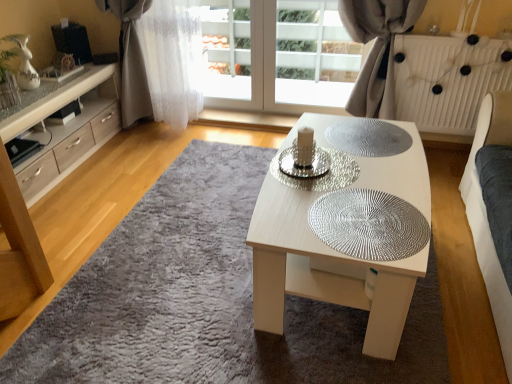
At what (x,y) coordinates should I click in order to perform the action: click on vacant space positioned to the left of white wood coffee table at center. Please return your answer as a coordinate pair (x, y). The image size is (512, 384). Looking at the image, I should click on (173, 262).